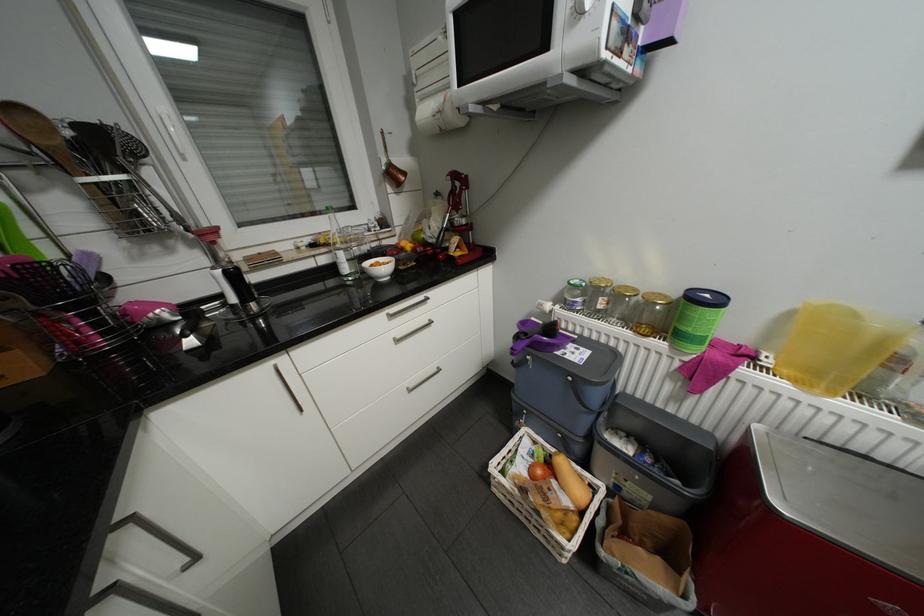
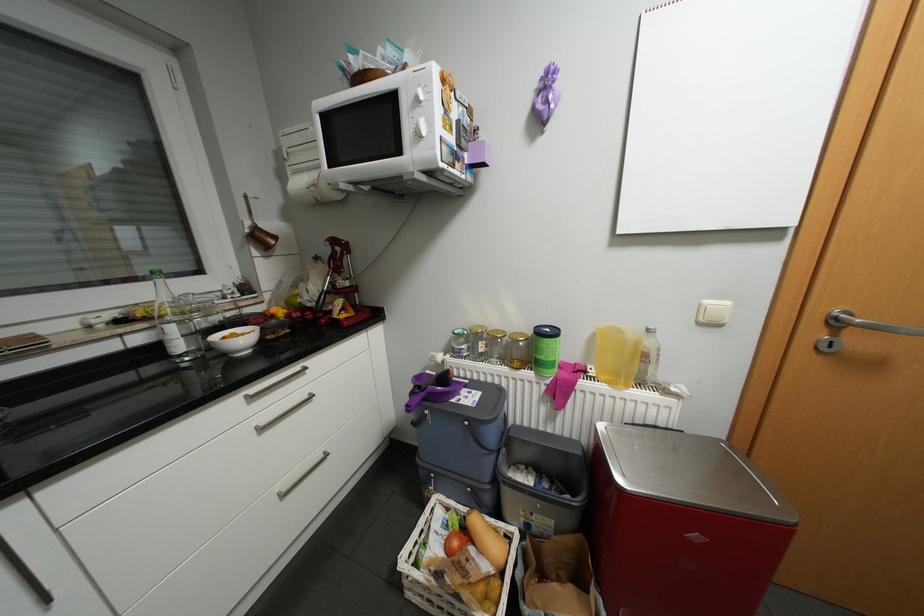
In the second image, find the point that corresponds to point 685,398 in the first image.

(558, 416)